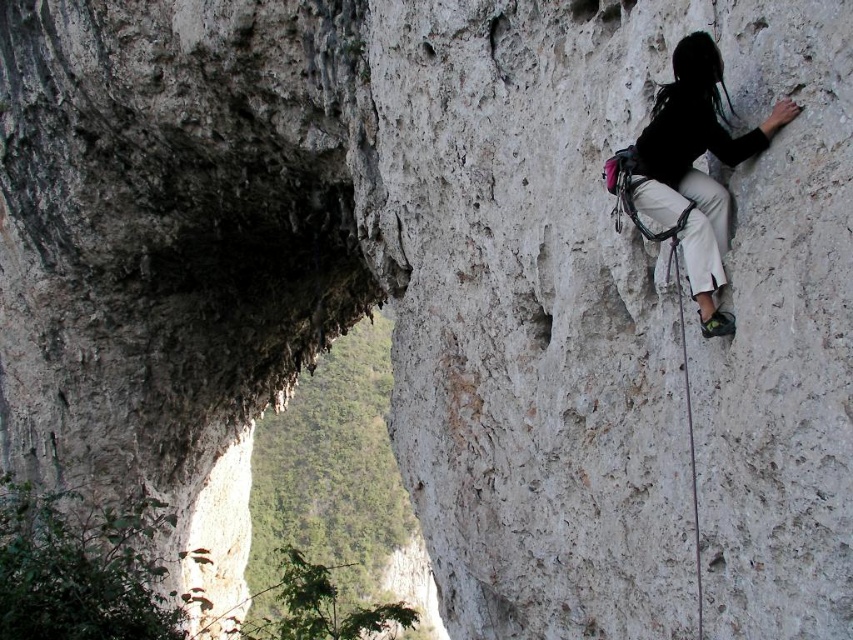
Question: Can you confirm if black fabric harness at right is bigger than white nylon rope at right?

Choices:
 (A) yes
 (B) no

Answer: (A)

Question: Which object appears farthest from the camera in this image?

Choices:
 (A) white nylon rope at right
 (B) black fabric harness at right

Answer: (A)

Question: Can you confirm if black fabric harness at right is positioned above white nylon rope at right?

Choices:
 (A) no
 (B) yes

Answer: (B)

Question: Which point is closer to the camera taking this photo?

Choices:
 (A) (689, 388)
 (B) (625, 157)

Answer: (A)

Question: Is black fabric harness at right above white nylon rope at right?

Choices:
 (A) yes
 (B) no

Answer: (A)